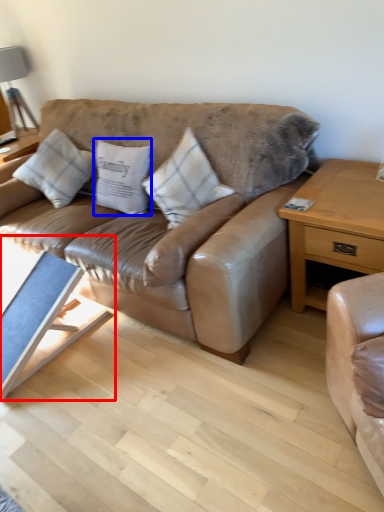
Question: Which object appears farthest to the camera in this image, coffee table (highlighted by a red box) or pillow (highlighted by a blue box)?

Choices:
 (A) coffee table
 (B) pillow

Answer: (B)